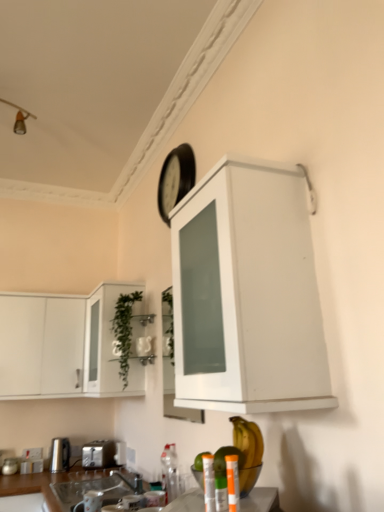
Find the location of a particular element. The height and width of the screenshot is (512, 384). brushed metal toaster at lower left, acting as the second appliance starting from the back is located at coordinates (10, 466).

Where is `translucent plastic bottle at lower center, the second bottle viewed from the left`? The height and width of the screenshot is (512, 384). translucent plastic bottle at lower center, the second bottle viewed from the left is located at coordinates (232, 483).

The height and width of the screenshot is (512, 384). What do you see at coordinates (60, 454) in the screenshot?
I see `polished stainless steel kettle at lower left, marked as the third appliance in a right-to-left arrangement` at bounding box center [60, 454].

This screenshot has width=384, height=512. I want to click on green leafy plant at center, so click(124, 330).

At what (x,y) coordinates should I click in order to perform the action: click on brushed metal toaster at lower left, positioned as the 4th appliance in top-to-bottom order. Please return your answer as a coordinate pair (x, y). Looking at the image, I should click on (10, 466).

Considering the sizes of objects satin silver toaster at lower center, marked as the second appliance in a bottom-to-top arrangement, and metallic silver can at lower center, which is counted as the first bottle, starting from the left, in the image provided, who is smaller, satin silver toaster at lower center, marked as the second appliance in a bottom-to-top arrangement, or metallic silver can at lower center, which is counted as the first bottle, starting from the left,?

metallic silver can at lower center, which is counted as the first bottle, starting from the left, is smaller.

Could you tell me if satin silver toaster at lower center, marked as the second appliance in a bottom-to-top arrangement, is turned towards metallic silver can at lower center, which is counted as the first bottle, starting from the left?

No, satin silver toaster at lower center, marked as the second appliance in a bottom-to-top arrangement, is not turned towards metallic silver can at lower center, which is counted as the first bottle, starting from the left.

Is the position of satin silver toaster at lower center, which appears as the 4th appliance when viewed from the front, less distant than that of metallic silver can at lower center, arranged as the second bottle when viewed from the right?

No, it is not.

Is satin silver toaster at lower center, the first appliance positioned from the back, surrounding metallic silver can at lower center, which is counted as the first bottle, starting from the left?

Definitely not — metallic silver can at lower center, which is counted as the first bottle, starting from the left, is not inside satin silver toaster at lower center, the first appliance positioned from the back.

Is clear glass sink at lower center not inside translucent plastic bottles at lower center, which appears as the 1th appliance when viewed from the top?

Yes, clear glass sink at lower center is not within translucent plastic bottles at lower center, which appears as the 1th appliance when viewed from the top.

Is clear glass sink at lower center oriented away from translucent plastic bottles at lower center, which is the fourth appliance from back to front?

clear glass sink at lower center does not have its back to translucent plastic bottles at lower center, which is the fourth appliance from back to front.

From the image's perspective, which is above, clear glass sink at lower center or translucent plastic bottles at lower center, arranged as the fourth appliance when ordered from the bottom?

translucent plastic bottles at lower center, arranged as the fourth appliance when ordered from the bottom, from the image's perspective.

From the image's perspective, which one is positioned lower, white glass cabinet at center, which appears as the third cabinetry when viewed from the left, or clear glass sink at lower center?

clear glass sink at lower center appears lower in the image.

Consider the image. Which is behind, white glass cabinet at center, which appears as the third cabinetry when viewed from the left, or clear glass sink at lower center?

clear glass sink at lower center.

How many degrees apart are the facing directions of white glass cabinet at center, which is counted as the 2th cabinetry, starting from the right, and clear glass sink at lower center?

The angular difference between white glass cabinet at center, which is counted as the 2th cabinetry, starting from the right, and clear glass sink at lower center is 0.391 degrees.

Is brushed metal toaster at lower left, the 1th appliance from the left, to the right of metallic silver can at lower center, arranged as the second bottle when viewed from the right, from the viewer's perspective?

No, brushed metal toaster at lower left, the 1th appliance from the left, is not to the right of metallic silver can at lower center, arranged as the second bottle when viewed from the right.

Is brushed metal toaster at lower left, the first appliance ordered from the bottom, surrounding metallic silver can at lower center, arranged as the second bottle when viewed from the right?

Definitely not — metallic silver can at lower center, arranged as the second bottle when viewed from the right, is not inside brushed metal toaster at lower left, the first appliance ordered from the bottom.

Is point (12, 471) closer to viewer compared to point (208, 473)?

That is False.

Is brushed metal toaster at lower left, the 1th appliance from the left, taller or shorter than metallic silver can at lower center, which is counted as the first bottle, starting from the left?

Clearly, brushed metal toaster at lower left, the 1th appliance from the left, is shorter compared to metallic silver can at lower center, which is counted as the first bottle, starting from the left.

Considering the positions of point (208, 475) and point (246, 476), is point (208, 475) closer or farther from the camera than point (246, 476)?

Point (208, 475).

In the image, is metallic silver can at lower center, arranged as the second bottle when viewed from the right, on the left side or the right side of translucent plastic bottles at lower center, marked as the 4th appliance in a left-to-right arrangement?

From the image, it's evident that metallic silver can at lower center, arranged as the second bottle when viewed from the right, is to the left of translucent plastic bottles at lower center, marked as the 4th appliance in a left-to-right arrangement.

Considering the relative sizes of metallic silver can at lower center, arranged as the second bottle when viewed from the right, and translucent plastic bottles at lower center, which is the fourth appliance from back to front, in the image provided, is metallic silver can at lower center, arranged as the second bottle when viewed from the right, bigger than translucent plastic bottles at lower center, which is the fourth appliance from back to front,?

Incorrect, metallic silver can at lower center, arranged as the second bottle when viewed from the right, is not larger than translucent plastic bottles at lower center, which is the fourth appliance from back to front.

In the scene shown: From the image's perspective, which is below, metallic silver can at lower center, arranged as the second bottle when viewed from the right, or translucent plastic bottles at lower center, which appears as the first appliance when viewed from the front?

translucent plastic bottles at lower center, which appears as the first appliance when viewed from the front, is shown below in the image.

Are yellow matte banana at lower center and white glass cabinet at center, which appears as the third cabinetry when viewed from the left, located far from each other?

No, yellow matte banana at lower center is not far from white glass cabinet at center, which appears as the third cabinetry when viewed from the left.

Is yellow matte banana at lower center facing away from white glass cabinet at center, which appears as the third cabinetry when viewed from the left?

No, yellow matte banana at lower center is not facing the opposite direction of white glass cabinet at center, which appears as the third cabinetry when viewed from the left.

Can you tell me how much yellow matte banana at lower center and white glass cabinet at center, which is counted as the 2th cabinetry, starting from the right, differ in facing direction?

The angular difference between yellow matte banana at lower center and white glass cabinet at center, which is counted as the 2th cabinetry, starting from the right, is 6 degrees.

Considering the relative sizes of yellow matte banana at lower center and white glass cabinet at center, which is counted as the 2th cabinetry, starting from the right, in the image provided, is yellow matte banana at lower center thinner than white glass cabinet at center, which is counted as the 2th cabinetry, starting from the right,?

No.

From a real-world perspective, between black matte clock at upper center and yellow matte banana at lower center, who is vertically higher?

From a 3D spatial view, black matte clock at upper center is above.

Is black matte clock at upper center located outside yellow matte banana at lower center?

Yes.

Considering the relative sizes of black matte clock at upper center and yellow matte banana at lower center in the image provided, is black matte clock at upper center thinner than yellow matte banana at lower center?

Correct, the width of black matte clock at upper center is less than that of yellow matte banana at lower center.

Which appliance is the 4th one when counting from the back of the metallic silver can at lower center, which is counted as the first bottle, starting from the left? Please provide its 2D coordinates.

[(103, 454)]

Identify the location of appliance in front of the clear glass sink at lower center. The height and width of the screenshot is (512, 384). (248, 479).

In the scene shown: Which object lies nearer to the anchor point metallic silver can at lower center, which is counted as the first bottle, starting from the left, clear glass sink at lower center or green glass cabinet at left, which is counted as the third cabinetry, starting from the right?

The object closer to metallic silver can at lower center, which is counted as the first bottle, starting from the left, is clear glass sink at lower center.

In the scene shown: Based on their spatial positions, is polished stainless steel kettle at lower left, the 3th appliance ordered from the bottom, or white glossy cabinet at left, marked as the 4th cabinetry in a right-to-left arrangement, further from brushed metal toaster at lower left, positioned as the 4th appliance in top-to-bottom order?

Based on the image, white glossy cabinet at left, marked as the 4th cabinetry in a right-to-left arrangement, appears to be further to brushed metal toaster at lower left, positioned as the 4th appliance in top-to-bottom order.

Considering their positions, is white glossy cabinet at left, the first cabinetry from the left, positioned further to satin silver toaster at lower center, positioned as the 3th appliance in top-to-bottom order, than yellow matte banana at lower center?

yellow matte banana at lower center is positioned further to the anchor satin silver toaster at lower center, positioned as the 3th appliance in top-to-bottom order.

When comparing their distances from translucent plastic bottles at lower center, which appears as the first appliance when viewed from the front, does translucent plastic bottle at lower center, the 1th bottle viewed from the right, or silver metallic faucet at lower center seem further?

silver metallic faucet at lower center lies further to translucent plastic bottles at lower center, which appears as the first appliance when viewed from the front, than the other object.

Based on their spatial positions, is green glass cabinet at left, positioned as the second cabinetry in left-to-right order, or translucent plastic bottles at lower center, the 1th appliance in the right-to-left sequence, closer to white matte cabinet at upper center, arranged as the first cabinetry when viewed from the right?

green glass cabinet at left, positioned as the second cabinetry in left-to-right order, is closer to white matte cabinet at upper center, arranged as the first cabinetry when viewed from the right.

Considering their positions, is satin silver toaster at lower center, which appears as the 4th appliance when viewed from the front, positioned further to brushed metal toaster at lower left, acting as the 3th appliance starting from the front, than clear glass sink at lower center?

clear glass sink at lower center lies further to brushed metal toaster at lower left, acting as the 3th appliance starting from the front, than the other object.

Which object lies nearer to the anchor point white glossy cabinet at left, marked as the 4th cabinetry in a right-to-left arrangement, silver metallic faucet at lower center or translucent plastic bottles at lower center, which appears as the 1th appliance when viewed from the top?

silver metallic faucet at lower center is closer to white glossy cabinet at left, marked as the 4th cabinetry in a right-to-left arrangement.

When comparing their distances from white matte cabinet at upper center, which ranks as the 4th cabinetry in left-to-right order, does silver metallic faucet at lower center or green glass cabinet at left, which is counted as the third cabinetry, starting from the right, seem closer?

green glass cabinet at left, which is counted as the third cabinetry, starting from the right, is closer to white matte cabinet at upper center, which ranks as the 4th cabinetry in left-to-right order.

In order to click on faucet that lies between green glass cabinet at left, positioned as the second cabinetry in left-to-right order, and satin silver toaster at lower center, the 2th appliance when ordered from right to left, from top to bottom in this screenshot , I will do `click(130, 479)`.

Where is `sink positioned between silver metallic faucet at lower center and satin silver toaster at lower center, marked as the second appliance in a bottom-to-top arrangement, from near to far`? This screenshot has height=512, width=384. sink positioned between silver metallic faucet at lower center and satin silver toaster at lower center, marked as the second appliance in a bottom-to-top arrangement, from near to far is located at coordinates (99, 488).

The height and width of the screenshot is (512, 384). In order to click on plant between black matte clock at upper center and satin silver toaster at lower center, the first appliance positioned from the back, in the up-down direction in this screenshot , I will do `click(124, 330)`.

Identify the location of banana positioned between metallic silver can at lower center, which is counted as the first bottle, starting from the left, and white glass cabinet at center, which is counted as the 2th cabinetry, starting from the right, from near to far. The width and height of the screenshot is (384, 512). (248, 451).